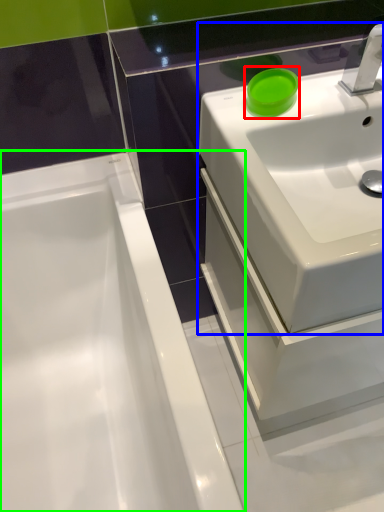
Question: Which object is the farthest from teal (highlighted by a red box)? Choose among these: sink (highlighted by a blue box) or bathtub (highlighted by a green box).

Choices:
 (A) sink
 (B) bathtub

Answer: (B)